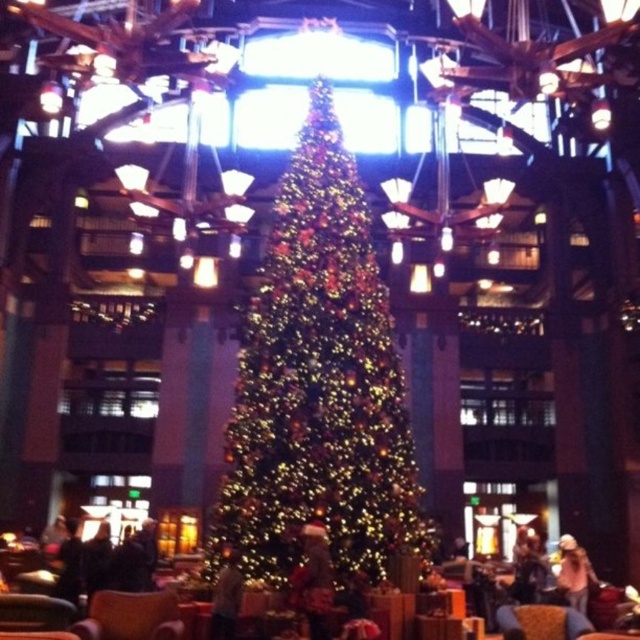
Based on the photo, can you confirm if iridescent gold christmas tree at center is shorter than brown leather armchair at lower center?

No.

The width and height of the screenshot is (640, 640). I want to click on iridescent gold christmas tree at center, so click(317, 385).

Which is more to the right, light brown leather jacket at lower center or denim jacket at lower right?

denim jacket at lower right

Is the position of light brown leather jacket at lower center more distant than that of denim jacket at lower right?

No, light brown leather jacket at lower center is closer to the viewer.

Find the location of a particular element. light brown leather jacket at lower center is located at coordinates (227, 598).

Does fuzzy brown coat at center appear over light brown leather jacket at lower center?

Indeed, fuzzy brown coat at center is positioned over light brown leather jacket at lower center.

Is point (308, 628) positioned behind point (211, 636)?

That is False.

Is point (300, 572) positioned behind point (230, 592)?

No, it is in front of (230, 592).

This screenshot has height=640, width=640. I want to click on fuzzy brown coat at center, so click(x=314, y=580).